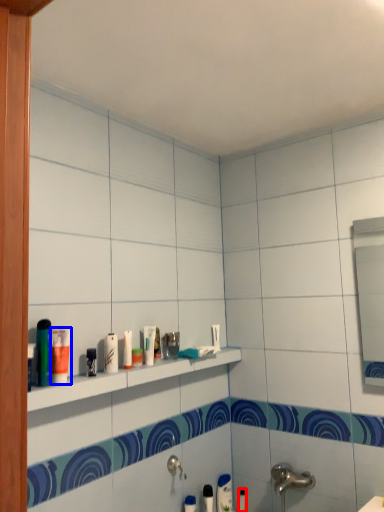
Question: Which point is further to the camera, toiletry (highlighted by a red box) or toiletry (highlighted by a blue box)?

Choices:
 (A) toiletry
 (B) toiletry

Answer: (A)